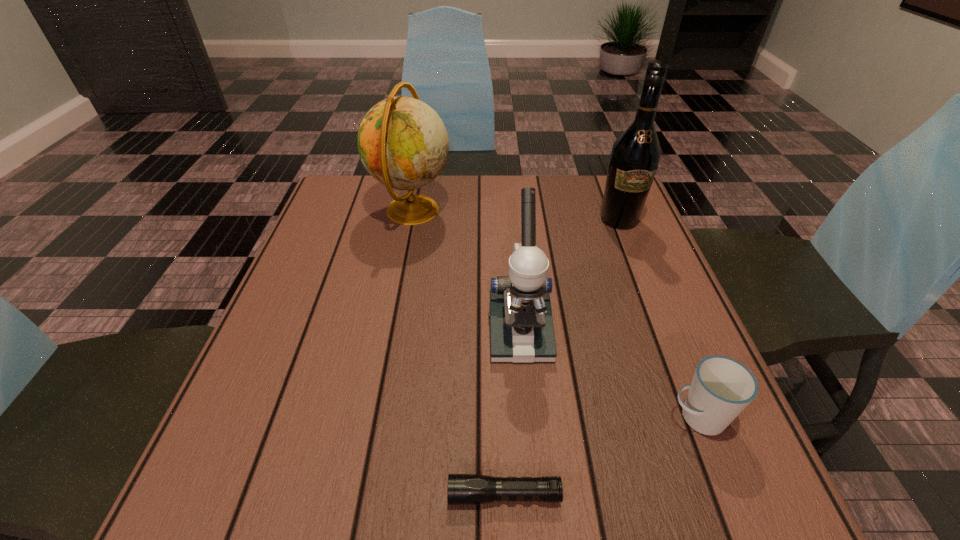
This screenshot has width=960, height=540. In order to click on free area in between the leftmost object and the microscope in this screenshot , I will do `click(466, 271)`.

Locate which object ranks in proximity to the fourth farthest object. Please provide its 2D coordinates. Your answer should be formatted as a tuple, i.e. [(x, y)], where the tuple contains the x and y coordinates of a point satisfying the conditions above.

[(521, 324)]

The image size is (960, 540). Identify the location of the closest object relative to the second nearest object. (521, 324).

Where is `blank space that satisfies the following two spatial constraints: 1. on the label of the wine bottle; 2. at the lens end of the flashlight`? The image size is (960, 540). blank space that satisfies the following two spatial constraints: 1. on the label of the wine bottle; 2. at the lens end of the flashlight is located at coordinates (727, 495).

What are the coordinates of `vacant area that satisfies the following two spatial constraints: 1. on the label of the tallest object; 2. at the lens end of the nearest object` in the screenshot? It's located at (727, 495).